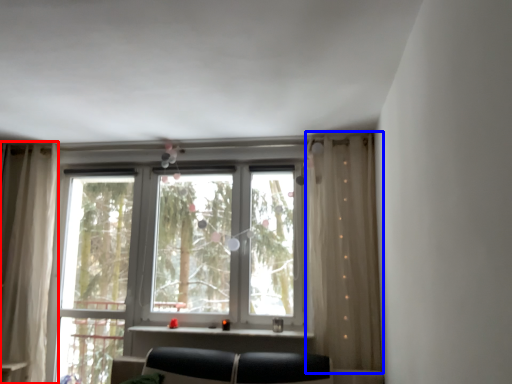
Question: Which of the following is the farthest to the observer, curtain (highlighted by a red box) or curtain (highlighted by a blue box)?

Choices:
 (A) curtain
 (B) curtain

Answer: (A)